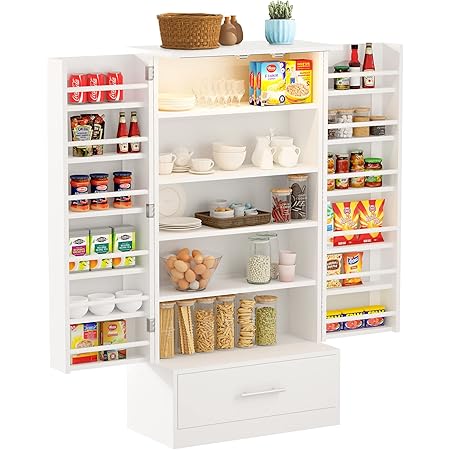
The width and height of the screenshot is (450, 450). Find the location of `teacups`. teacups is located at coordinates click(167, 158), click(164, 170), click(177, 155), click(201, 165).